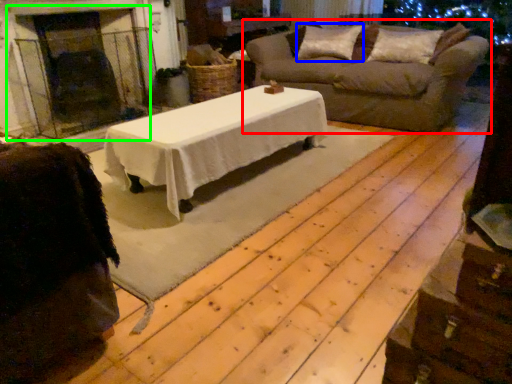
Question: Considering the real-world distances, which object is closest to studio sofa (highlighted by a red box)? pillow (highlighted by a blue box) or fireplace (highlighted by a green box).

Choices:
 (A) pillow
 (B) fireplace

Answer: (A)